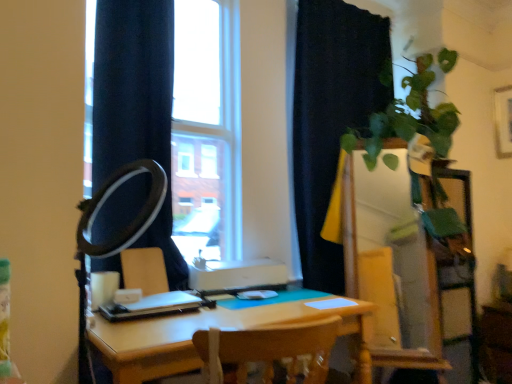
Question: In the image, is black matte ring light at left on the left side or the right side of black matte curtain at upper right?

Choices:
 (A) left
 (B) right

Answer: (A)

Question: Relative to black matte curtain at upper right, is black matte ring light at left in front or behind?

Choices:
 (A) behind
 (B) front

Answer: (B)

Question: Based on their relative distances, which object is nearer to the green glossy dresser at right?

Choices:
 (A) matte white armchair at center
 (B) black matte ring light at left
 (C) light brown wooden table at center
 (D) transparent glass window at center
 (E) black matte curtain at upper right

Answer: (E)

Question: Which is nearer to the green glossy dresser at right?

Choices:
 (A) black matte ring light at left
 (B) light brown wooden table at center
 (C) black matte curtain at upper right
 (D) transparent glass window at center
 (E) matte white armchair at center

Answer: (C)